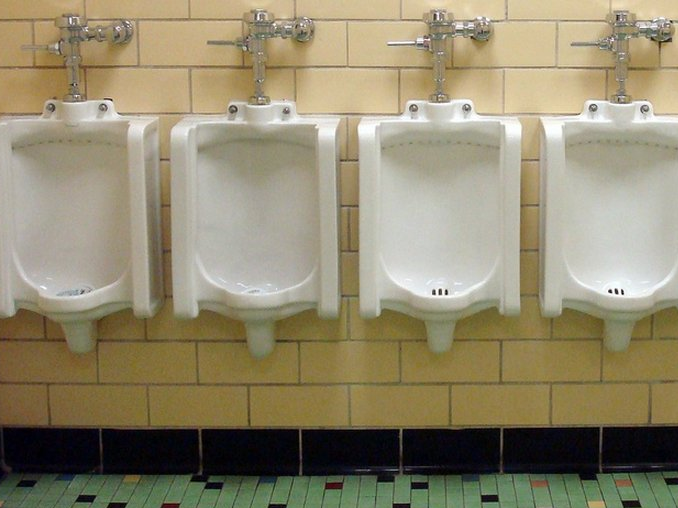
Find the location of a particular element. The image size is (678, 508). urinals is located at coordinates (111, 217), (239, 239), (426, 230), (655, 215).